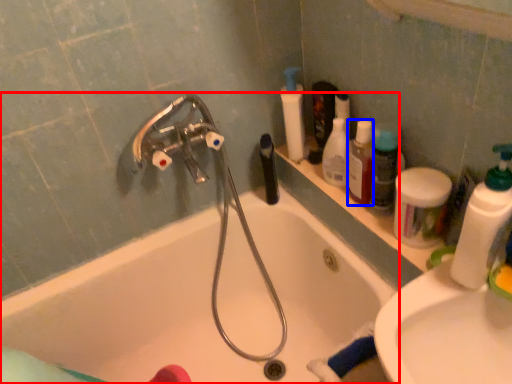
Question: Which object appears closest to the camera in this image, bathtub (highlighted by a red box) or mouthwash (highlighted by a blue box)?

Choices:
 (A) bathtub
 (B) mouthwash

Answer: (A)